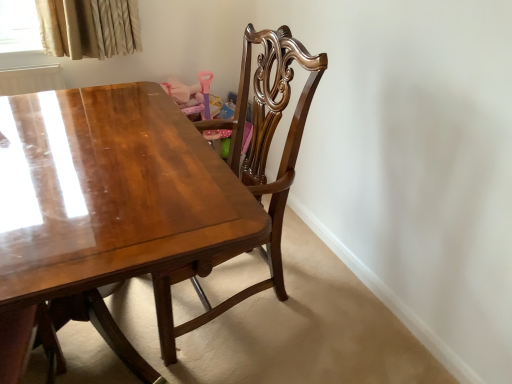
Identify the location of shiny wood chair at center. (252, 167).

Describe the element at coordinates (252, 167) in the screenshot. The image size is (512, 384). I see `shiny wood chair at center` at that location.

Where is `shiny wood chair at center`? shiny wood chair at center is located at coordinates (252, 167).